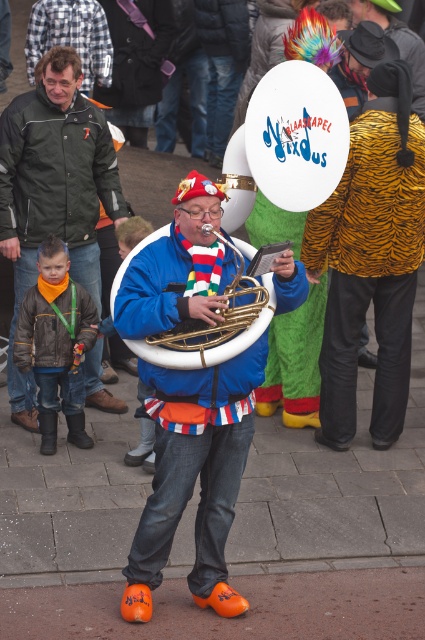
Does green matte jacket at upper left have a greater width compared to gold brass trumpet at center?

Indeed, green matte jacket at upper left has a greater width compared to gold brass trumpet at center.

Who is more distant from viewer, (79, 122) or (184, 364)?

Positioned behind is point (79, 122).

Identify the location of green matte jacket at upper left. [53, 188].

The width and height of the screenshot is (425, 640). What are the coordinates of `green matte jacket at upper left` in the screenshot? It's located at (53, 188).

Can you confirm if gold brass tuba at center is positioned above brown leather jacket at lower left?

Actually, gold brass tuba at center is below brown leather jacket at lower left.

Looking at this image, is gold brass tuba at center in front of brown leather jacket at lower left?

Yes, gold brass tuba at center is in front of brown leather jacket at lower left.

The height and width of the screenshot is (640, 425). Describe the element at coordinates (195, 476) in the screenshot. I see `gold brass tuba at center` at that location.

Identify the location of gold brass tuba at center. (195, 476).

Is green matte jacket at upper left bigger than brushed metal face at upper left?

Yes.

Is point (116, 224) farther from camera compared to point (96, 45)?

No, (116, 224) is in front of (96, 45).

Does point (82, 140) lie behind point (31, 80)?

No, (82, 140) is in front of (31, 80).

The height and width of the screenshot is (640, 425). I want to click on green matte jacket at upper left, so click(x=53, y=188).